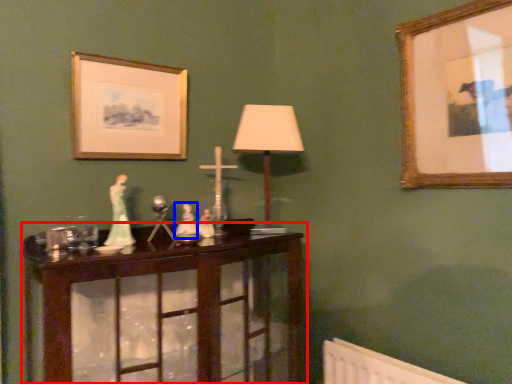
Question: Which object is closer to the camera taking this photo, table (highlighted by a red box) or toy (highlighted by a blue box)?

Choices:
 (A) table
 (B) toy

Answer: (A)